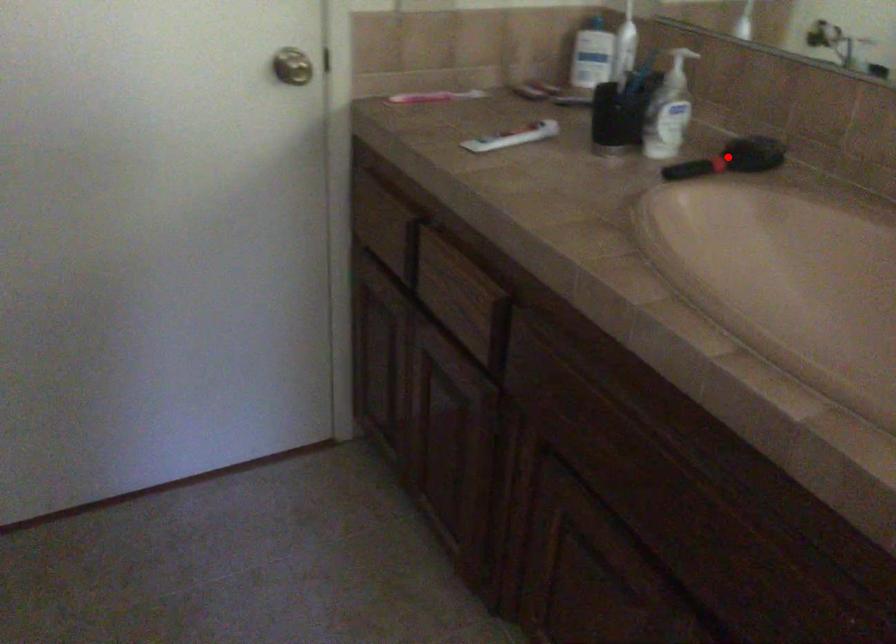
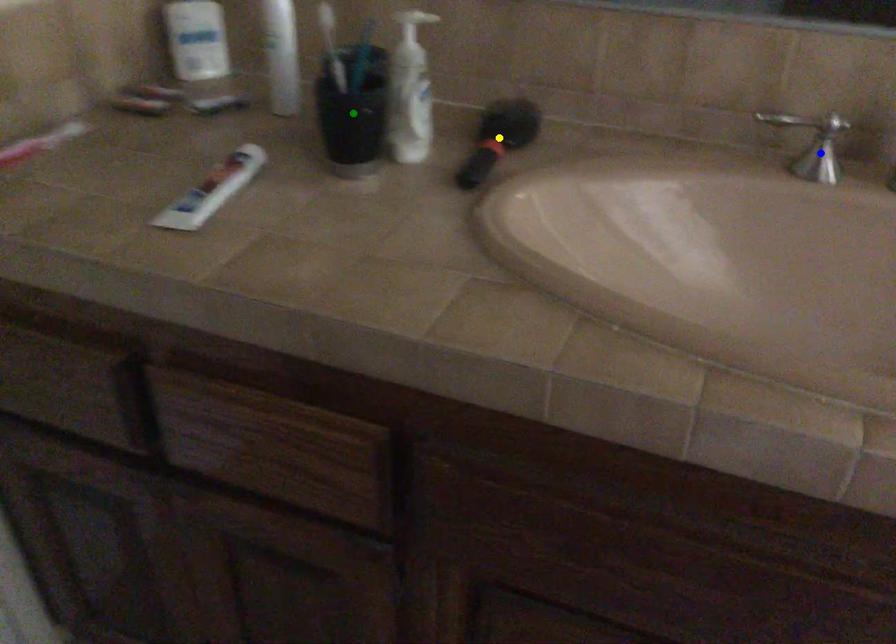
Question: I am providing you with two images of the same scene from different viewpoints. A red point is marked on the first image. You are given multiple points on the second image. Which spot in image 2 lines up with the point in image 1?

Choices:
 (A) green point
 (B) blue point
 (C) yellow point

Answer: (C)